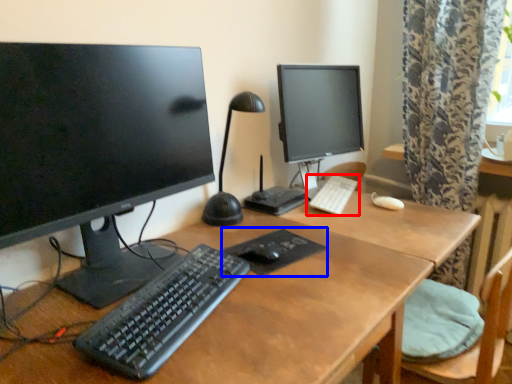
Question: Which point is closer to the camera, computer keyboard (highlighted by a red box) or mousepad (highlighted by a blue box)?

Choices:
 (A) computer keyboard
 (B) mousepad

Answer: (B)